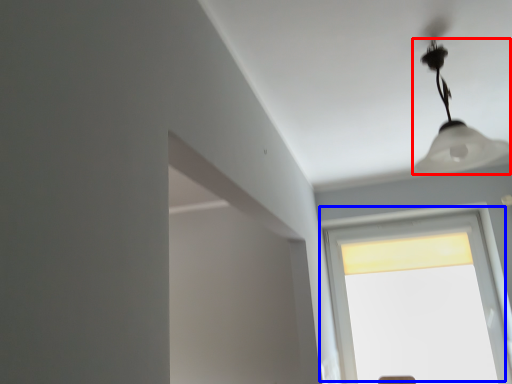
Question: Which of the following is the closest to the observer, lamp (highlighted by a red box) or window (highlighted by a blue box)?

Choices:
 (A) lamp
 (B) window

Answer: (A)